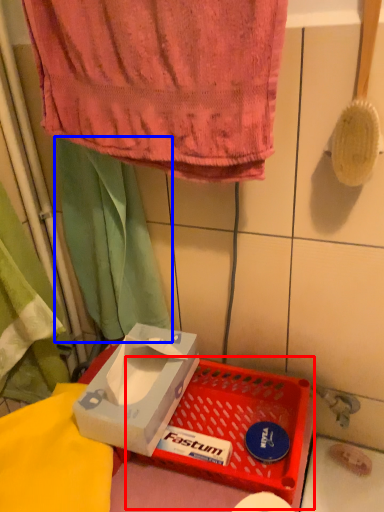
Question: Which object is closer to the camera taking this photo, basket (highlighted by a red box) or curtain (highlighted by a blue box)?

Choices:
 (A) basket
 (B) curtain

Answer: (A)